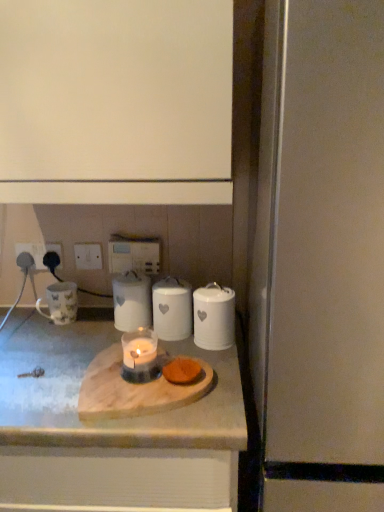
Identify the location of free space that is in between translucent glass candle at center and white glossy mug at left, which appears as the 5th appliance when viewed from the right. Image resolution: width=384 pixels, height=512 pixels. (79, 338).